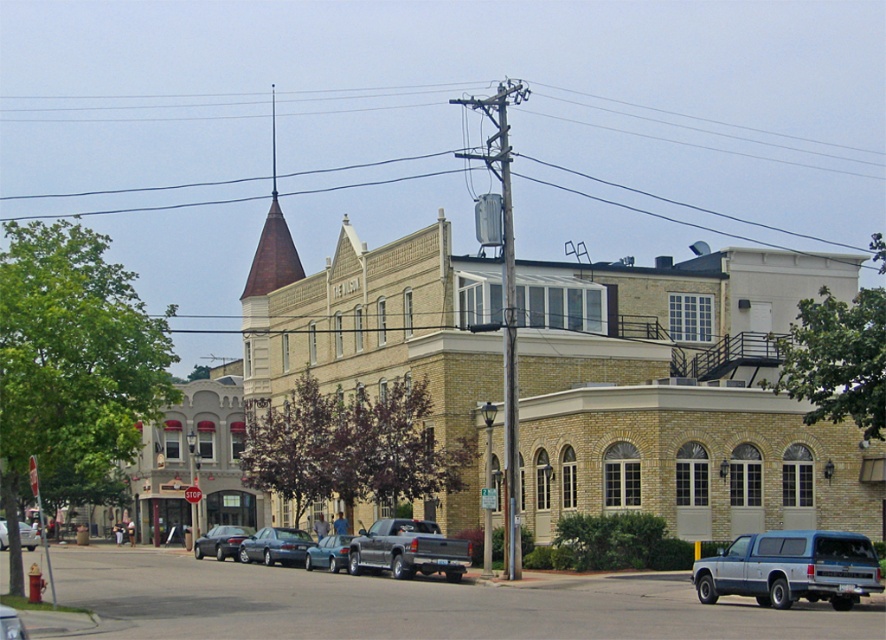
From the picture: Is beige brick building at center shorter than metallic gray truck at center?

Incorrect, beige brick building at center's height does not fall short of metallic gray truck at center's.

Which is in front, point (535, 506) or point (379, 522)?

Point (379, 522) is in front.

Is point (381, 292) behind point (366, 538)?

Yes.

Where is `beige brick building at center`? beige brick building at center is located at coordinates (682, 396).

Does metallic gray truck at center have a lesser height compared to brown clay spire at upper center?

Indeed, metallic gray truck at center has a lesser height compared to brown clay spire at upper center.

Is metallic gray truck at center further to the viewer compared to brown clay spire at upper center?

No, it is in front of brown clay spire at upper center.

Which is in front, point (354, 560) or point (273, 227)?

Point (354, 560)

Locate an element on the screen. metallic gray truck at center is located at coordinates (408, 548).

Between metallic gray truck at center and metallic gray sedan at lower left, which one is positioned lower?

metallic gray truck at center

Is metallic gray truck at center positioned in front of metallic gray sedan at lower left?

No, it is behind metallic gray sedan at lower left.

Between point (378, 560) and point (9, 609), which one is positioned in front?

Point (9, 609) is more forward.

In order to click on metallic gray truck at center in this screenshot , I will do `click(408, 548)`.